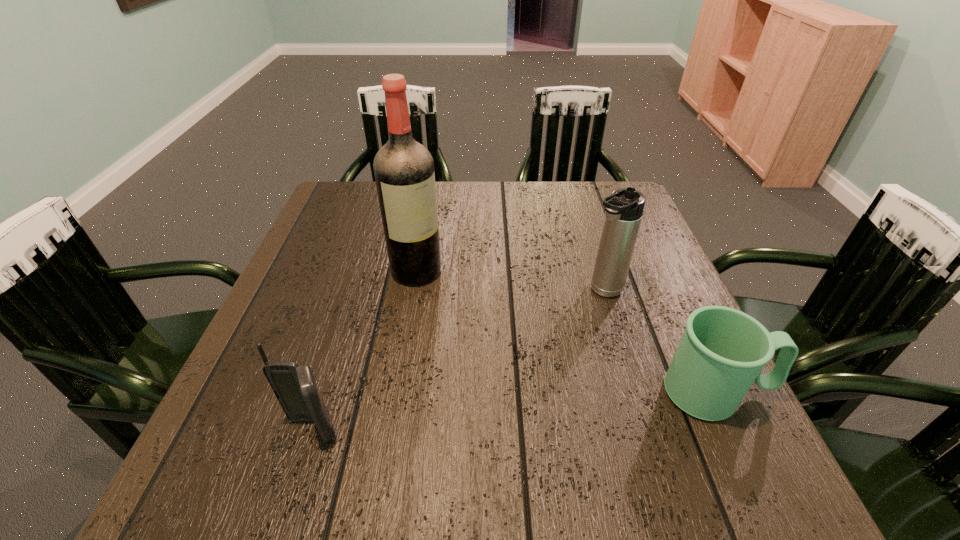
Identify the location of cellular telephone. (294, 386).

The height and width of the screenshot is (540, 960). I want to click on the second shortest object, so click(x=294, y=386).

Where is `mug`? The image size is (960, 540). mug is located at coordinates coord(722,352).

Where is `the rightmost object`? This screenshot has height=540, width=960. the rightmost object is located at coordinates (722, 352).

The width and height of the screenshot is (960, 540). Identify the location of the third object from right to left. (404, 173).

The width and height of the screenshot is (960, 540). I want to click on the tallest object, so point(404,173).

Locate an element on the screen. This screenshot has height=540, width=960. thermos bottle is located at coordinates (624, 208).

This screenshot has width=960, height=540. I want to click on the second object from right to left, so click(x=624, y=208).

Locate an element on the screen. The height and width of the screenshot is (540, 960). vacant area situated 0.100m on the front-facing side of the liquor is located at coordinates coord(452,310).

Where is `blank area located 0.210m on the front-facing side of the liquor`? The width and height of the screenshot is (960, 540). blank area located 0.210m on the front-facing side of the liquor is located at coordinates (482, 341).